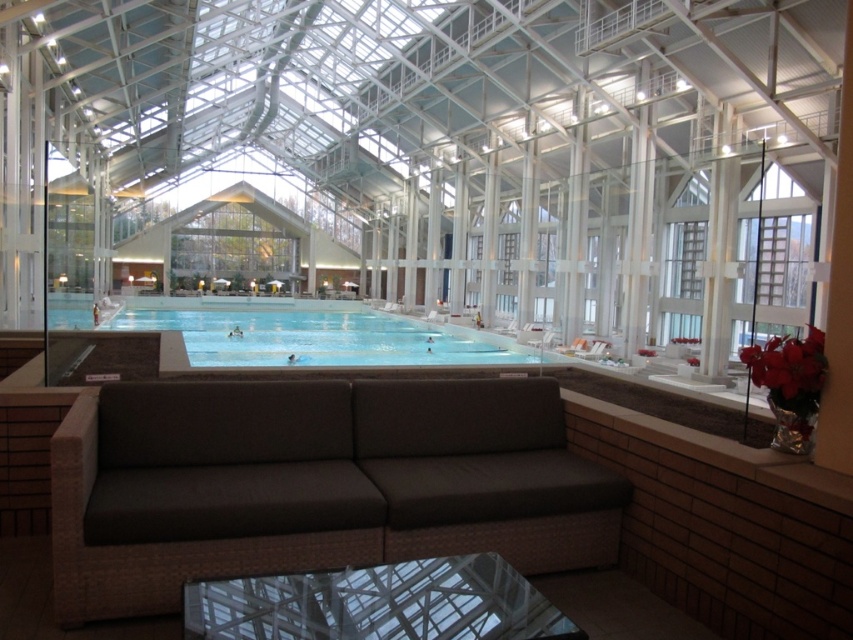
Question: Based on their relative distances, which object is nearer to the brown wicker couch at lower center?

Choices:
 (A) transparent glass table at lower center
 (B) clear blue water at center

Answer: (A)

Question: Among these objects, which one is farthest from the camera?

Choices:
 (A) clear blue water at center
 (B) transparent glass table at lower center
 (C) brown wicker couch at lower center

Answer: (A)

Question: Does transparent glass table at lower center appear over clear blue water at center?

Choices:
 (A) no
 (B) yes

Answer: (A)

Question: Is brown wicker couch at lower center wider than transparent glass table at lower center?

Choices:
 (A) no
 (B) yes

Answer: (B)

Question: Does brown wicker couch at lower center have a greater width compared to clear blue water at center?

Choices:
 (A) no
 (B) yes

Answer: (A)

Question: Which point is farther from the camera taking this photo?

Choices:
 (A) (215, 588)
 (B) (354, 384)

Answer: (B)